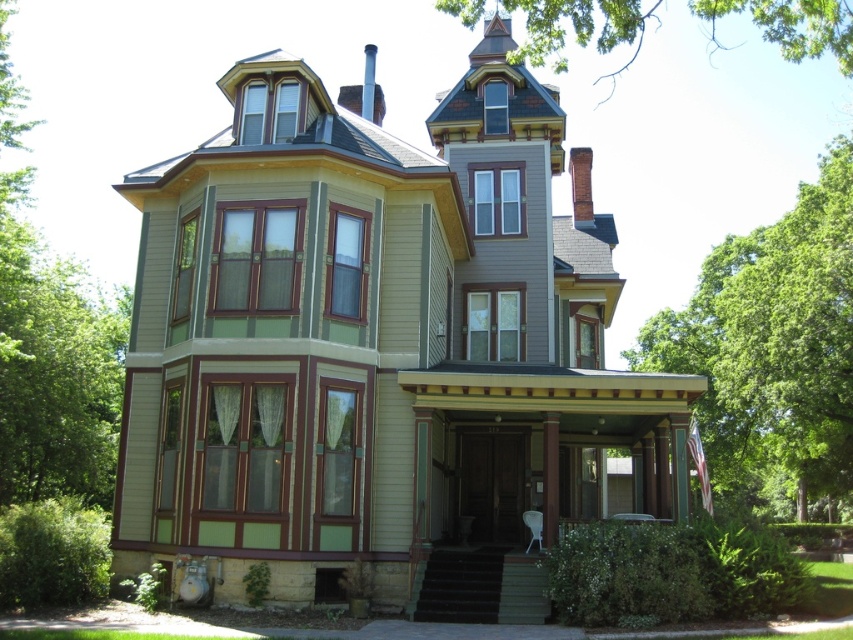
Consider the image. Does green leafy tree at upper right appear over green leafy tree at upper center?

Actually, green leafy tree at upper right is below green leafy tree at upper center.

Based on the photo, between green leafy tree at upper right and green leafy tree at upper center, which one is positioned higher?

Positioned higher is green leafy tree at upper center.

Who is more forward, (703, 305) or (619, 20)?

Positioned in front is point (619, 20).

Where is `green leafy tree at upper right`? Image resolution: width=853 pixels, height=640 pixels. green leafy tree at upper right is located at coordinates (773, 346).